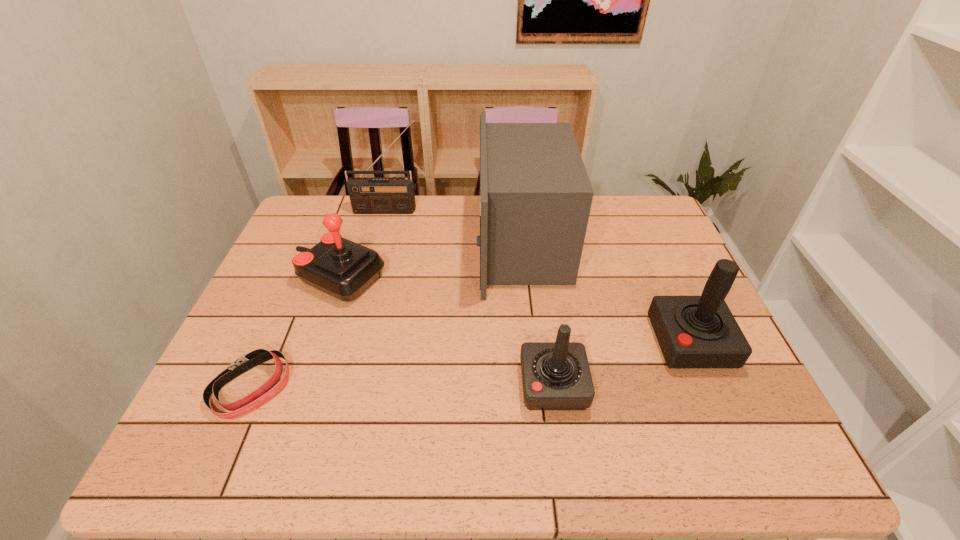
The width and height of the screenshot is (960, 540). Identify the location of radio receiver that is at the far edge. (394, 195).

Locate an element on the screen. The width and height of the screenshot is (960, 540). joystick at the left edge is located at coordinates (343, 269).

Find the location of a particular element. This screenshot has width=960, height=540. dog collar present at the left edge is located at coordinates (255, 399).

Where is `object situated at the right edge`? object situated at the right edge is located at coordinates (692, 331).

Identify the location of vacant space at the far edge. This screenshot has height=540, width=960. (348, 224).

In order to click on vacant region at the near edge of the desktop in this screenshot , I will do `click(335, 444)`.

In the image, there is a desktop. At what (x,y) coordinates should I click in order to perform the action: click on vacant space at the left edge. Please return your answer as a coordinate pair (x, y). The image size is (960, 540). Looking at the image, I should click on (288, 325).

The height and width of the screenshot is (540, 960). I want to click on vacant area at the right edge of the desktop, so click(656, 256).

Find the location of `blank space at the near left corner of the desktop`. blank space at the near left corner of the desktop is located at coordinates (180, 450).

At what (x,y) coordinates should I click in order to perform the action: click on vacant region at the far right corner of the desktop. Please return your answer as a coordinate pair (x, y). The width and height of the screenshot is (960, 540). Looking at the image, I should click on (634, 224).